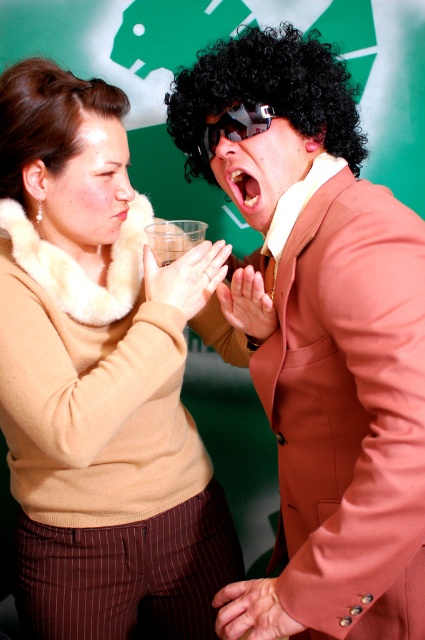
Does beige fur sweater at center have a lesser height compared to brown matte suit at center?

Yes.

Is beige fur sweater at center to the left of brown matte suit at center from the viewer's perspective?

Indeed, beige fur sweater at center is positioned on the left side of brown matte suit at center.

Does point (107, 141) come farther from viewer compared to point (380, 253)?

Yes, point (107, 141) is farther from viewer.

Where is `beige fur sweater at center`? The height and width of the screenshot is (640, 425). beige fur sweater at center is located at coordinates point(99,380).

Does beige fur sweater at center appear under black curly wig at upper left?

Yes, beige fur sweater at center is below black curly wig at upper left.

Can you confirm if beige fur sweater at center is taller than black curly wig at upper left?

Correct, beige fur sweater at center is much taller as black curly wig at upper left.

Which is in front, point (226, 570) or point (87, 93)?

Point (87, 93) is more forward.

Find the location of a particular element. The image size is (425, 640). beige fur sweater at center is located at coordinates (99, 380).

Between brown matte suit at center and black curly wig at center, which one is positioned lower?

brown matte suit at center is lower down.

What do you see at coordinates (323, 340) in the screenshot? This screenshot has width=425, height=640. I see `brown matte suit at center` at bounding box center [323, 340].

Where is `brown matte suit at center`? The image size is (425, 640). brown matte suit at center is located at coordinates (323, 340).